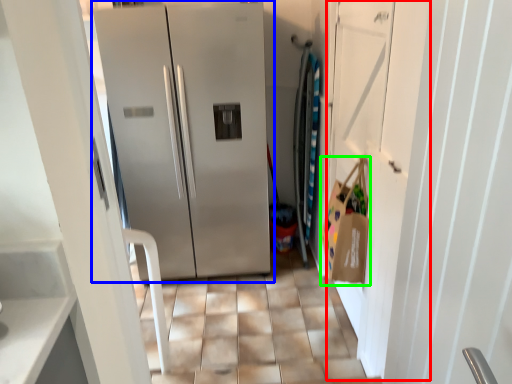
Question: Which is farther away from door (highlighted by a red box)? refrigerator (highlighted by a blue box) or shopping bag (highlighted by a green box)?

Choices:
 (A) refrigerator
 (B) shopping bag

Answer: (A)